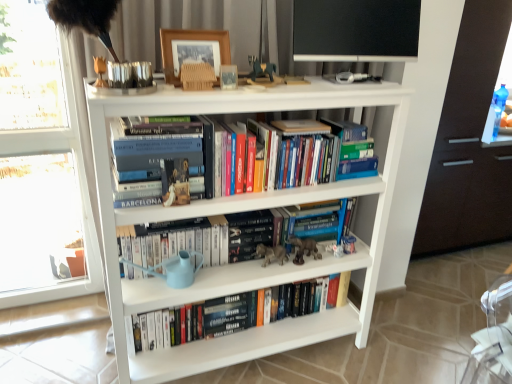
Question: From a real-world perspective, is wooden picture frame at upper center physically located above or below black matte computer monitor at upper center?

Choices:
 (A) above
 (B) below

Answer: (B)

Question: Considering their positions, is wooden picture frame at upper center located in front of or behind black matte computer monitor at upper center?

Choices:
 (A) front
 (B) behind

Answer: (A)

Question: Considering the real-world distances, which object is farthest from the black matte paperback book at center?

Choices:
 (A) matte brown figurine at center
 (B) white matte bookshelf at center
 (C) transparent glass screen door at right
 (D) white plastic window frame at left
 (E) hardcover books at center left

Answer: (C)

Question: Which is nearer to the black matte computer monitor at upper center?

Choices:
 (A) wooden picture frame at upper center
 (B) dark brown wood drawer at right
 (C) transparent glass screen door at right
 (D) white matte bookshelf at center
 (E) matte brown figurine at center

Answer: (A)